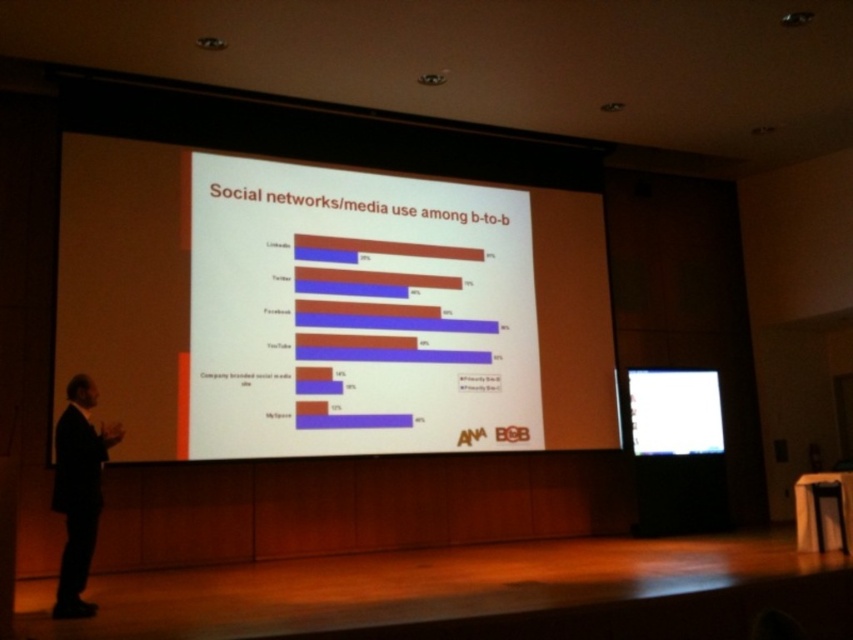
Question: Observing the image, what is the correct spatial positioning of white matte projection screen at center in reference to white glossy projector screen at center?

Choices:
 (A) above
 (B) below

Answer: (A)

Question: Is black suit at left further to the viewer compared to white glossy projector screen at center?

Choices:
 (A) no
 (B) yes

Answer: (A)

Question: Based on their relative distances, which object is farther from the white glossy projector screen at center?

Choices:
 (A) black suit at left
 (B) white matte projection screen at center

Answer: (A)

Question: Considering the real-world distances, which object is farthest from the white glossy projector screen at center?

Choices:
 (A) white matte projection screen at center
 (B) black suit at left

Answer: (B)

Question: Can you confirm if white matte projection screen at center is positioned to the left of black suit at left?

Choices:
 (A) no
 (B) yes

Answer: (A)

Question: Which point appears farthest from the camera in this image?

Choices:
 (A) (96, 513)
 (B) (631, 428)

Answer: (B)